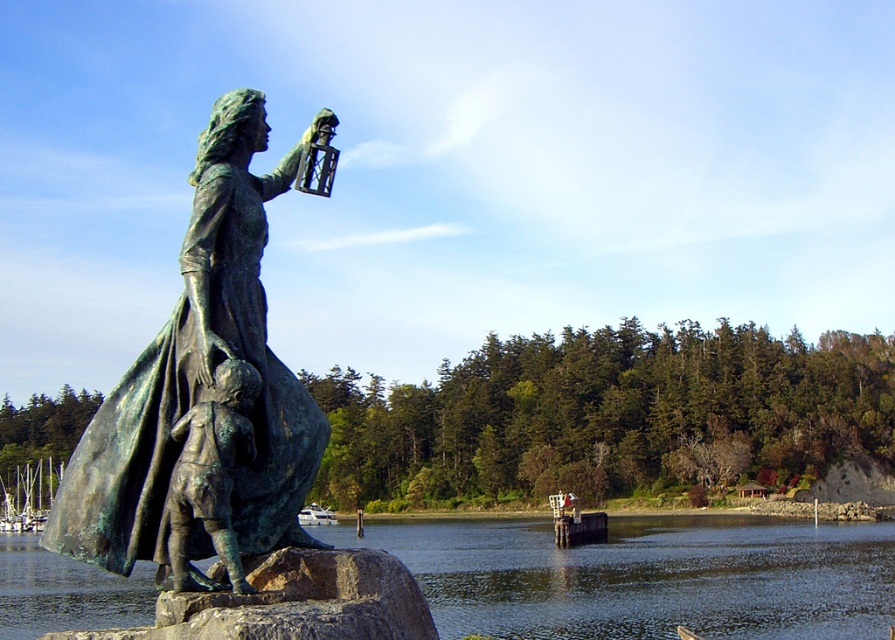
Question: Can you confirm if green patina statue at center is positioned above white glossy boat at center?

Choices:
 (A) yes
 (B) no

Answer: (A)

Question: Which of the following is the closest to the observer?

Choices:
 (A) greenish reflective water at lower center
 (B) green patina statue at center
 (C) bronze statue child at lower left
 (D) brushed metal boats at left

Answer: (C)

Question: Is green patina statue at center wider than white glossy boat at center?

Choices:
 (A) yes
 (B) no

Answer: (B)

Question: Is bronze statue child at lower left to the right of white glossy boat at center from the viewer's perspective?

Choices:
 (A) yes
 (B) no

Answer: (A)

Question: Which object appears farthest from the camera in this image?

Choices:
 (A) brushed metal boats at left
 (B) green patina statue at center

Answer: (A)

Question: Which of the following is the closest to the observer?

Choices:
 (A) bronze statue child at lower left
 (B) greenish reflective water at lower center
 (C) green patina statue at center

Answer: (A)